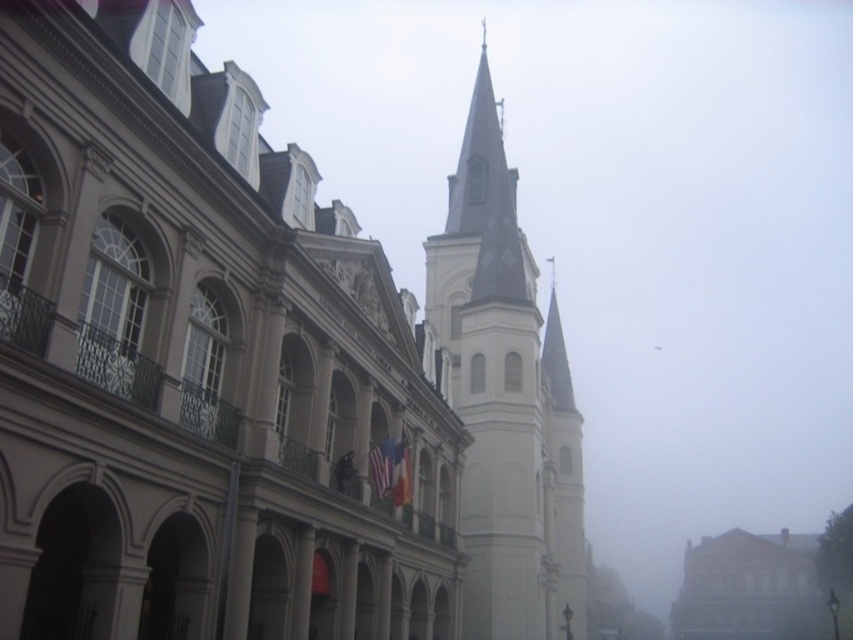
Which is above, white stone church at center or smooth white building at lower right?

white stone church at center is above.

Measure the distance between white stone church at center and camera.

white stone church at center and camera are 29.96 meters apart.

You are a GUI agent. You are given a task and a screenshot of the screen. Output one action in this format:
    pyautogui.click(x=<x>, y=<y>)
    Task: Click on the white stone church at center
    The height and width of the screenshot is (640, 853).
    Given the screenshot: What is the action you would take?
    pyautogui.click(x=198, y=360)

Is white stone steeple at center positioned in front of smooth white building at lower right?

Yes, it is.

Between white stone steeple at center and smooth white building at lower right, which one is positioned higher?

Positioned higher is white stone steeple at center.

Find the location of a particular element. The image size is (853, 640). white stone steeple at center is located at coordinates (506, 401).

Where is `white stone steeple at center`? This screenshot has height=640, width=853. white stone steeple at center is located at coordinates (506, 401).

Is white stone church at center wider than white stone steeple at center?

No, white stone church at center is not wider than white stone steeple at center.

Is white stone church at center above white stone steeple at center?

Incorrect, white stone church at center is not positioned above white stone steeple at center.

Find the location of `white stone church at center`. white stone church at center is located at coordinates (198, 360).

Image resolution: width=853 pixels, height=640 pixels. I want to click on white stone church at center, so click(x=198, y=360).